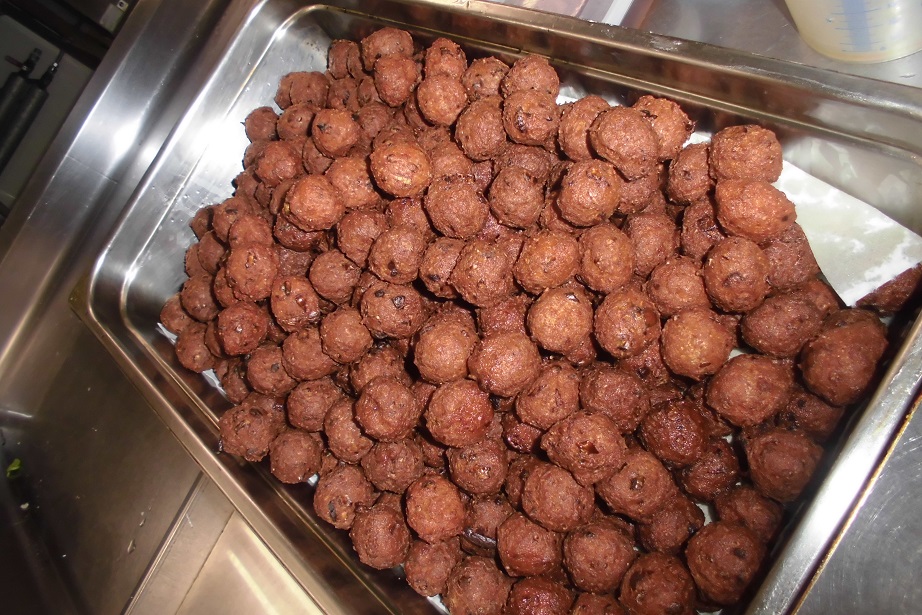
The height and width of the screenshot is (615, 922). I want to click on cylindrical devices on the wall, so click(x=9, y=109), click(x=30, y=109).